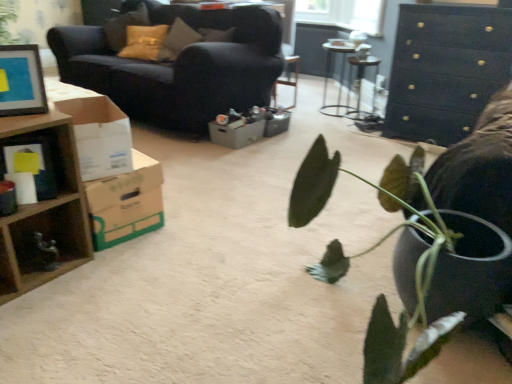
What is the approximate height of brown cardboard box at left, the 2th cardboard box from the back?

12.85 inches.

How much space does white cardboard box at left, positioned as the first cardboard box in front-to-back order, occupy horizontally?

white cardboard box at left, positioned as the first cardboard box in front-to-back order, is 26.90 centimeters in width.

The height and width of the screenshot is (384, 512). Describe the element at coordinates (361, 82) in the screenshot. I see `metallic silver table at center, the 2th table positioned from the left` at that location.

Identify the location of green matte plant at center. The height and width of the screenshot is (384, 512). click(x=370, y=251).

How much space does gray cardboard box at center, which ranks as the third cardboard box in front-to-back order, occupy horizontally?

It is 11.07 inches.

Describe the element at coordinates (330, 70) in the screenshot. The width and height of the screenshot is (512, 384). I see `metallic silver table at center, the second table from the right` at that location.

At what (x,y) coordinates should I click in order to perform the action: click on brown cardboard box at left, the 2th cardboard box from the back. Please return your answer as a coordinate pair (x, y). The height and width of the screenshot is (384, 512). Looking at the image, I should click on click(126, 203).

Which is in front, point (343, 74) or point (353, 65)?

The point (353, 65) is more forward.

Would you say metallic silver table at center, which ranks as the 1th table in right-to-left order, is part of metallic silver table at center, which is counted as the 1th table, starting from the left,'s contents?

Absolutely, metallic silver table at center, which ranks as the 1th table in right-to-left order, is inside metallic silver table at center, which is counted as the 1th table, starting from the left.

Where is `table below the metallic silver table at center, which is counted as the 1th table, starting from the left (from the image's perspective)`? This screenshot has height=384, width=512. table below the metallic silver table at center, which is counted as the 1th table, starting from the left (from the image's perspective) is located at coordinates (361, 82).

From a real-world perspective, does green matte plant at center sit lower than wooden cube at left?

No, from a real-world perspective, green matte plant at center is not beneath wooden cube at left.

Measure the distance from green matte plant at center to wooden cube at left.

green matte plant at center is 3.68 feet away from wooden cube at left.

Which of these two, green matte plant at center or wooden cube at left, is bigger?

green matte plant at center.

Is dark blue fabric couch at upper left behind metallic silver table at center, which is counted as the 1th table, starting from the left?

No.

From the image's perspective, is dark blue fabric couch at upper left positioned above or below metallic silver table at center, the second table from the right?

dark blue fabric couch at upper left is above metallic silver table at center, the second table from the right.

Who is bigger, dark blue fabric couch at upper left or metallic silver table at center, the second table from the right?

dark blue fabric couch at upper left is bigger.

Are dark blue fabric couch at upper left and metallic silver table at center, the second table from the right, located far from each other?

Yes, dark blue fabric couch at upper left is far from metallic silver table at center, the second table from the right.

From a real-world perspective, which object rests below the other?

gray cardboard box at center, which ranks as the third cardboard box in front-to-back order, from a real-world perspective.

Which object is positioned more to the right, gray cardboard box at center, which ranks as the third cardboard box in front-to-back order, or metallic silver table at center, which ranks as the 1th table in right-to-left order?

metallic silver table at center, which ranks as the 1th table in right-to-left order.

Which of these two, gray cardboard box at center, which ranks as the third cardboard box in front-to-back order, or metallic silver table at center, the 2th table positioned from the left, is bigger?

metallic silver table at center, the 2th table positioned from the left, is bigger.

How different are the orientations of gray cardboard box at center, the first cardboard box when ordered from back to front, and metallic silver table at center, which ranks as the 1th table in right-to-left order, in degrees?

The angular difference between gray cardboard box at center, the first cardboard box when ordered from back to front, and metallic silver table at center, which ranks as the 1th table in right-to-left order, is 90.8 degrees.

Does wooden cube at left come in front of brown cardboard box at left, the second cardboard box in the front-to-back sequence?

Yes, wooden cube at left is closer to the viewer.

Is brown cardboard box at left, the second cardboard box in the front-to-back sequence, at the back of wooden cube at left?

No, brown cardboard box at left, the second cardboard box in the front-to-back sequence, is not at the back of wooden cube at left.

Does wooden cube at left appear on the right side of brown cardboard box at left, the second cardboard box in the front-to-back sequence?

No.

Looking at this image, considering the sizes of objects wooden cube at left and brown cardboard box at left, the second cardboard box in the front-to-back sequence, in the image provided, who is taller, wooden cube at left or brown cardboard box at left, the second cardboard box in the front-to-back sequence,?

wooden cube at left is taller.

Which is behind, point (21, 224) or point (27, 55)?

The point (21, 224) is more distant.

Is wooden cube at left not close to matte black picture frame at upper left?

wooden cube at left is near matte black picture frame at upper left, not far away.

From the picture: Is wooden cube at left completely or partially outside of matte black picture frame at upper left?

Yes, wooden cube at left is not within matte black picture frame at upper left.

From a real-world perspective, does wooden cube at left sit lower than matte black picture frame at upper left?

Indeed, from a real-world perspective, wooden cube at left is positioned beneath matte black picture frame at upper left.

Looking at this image, is metallic silver table at center, the second table from the right, behind matte black picture frame at upper left?

Yes, metallic silver table at center, the second table from the right, is behind matte black picture frame at upper left.

Does metallic silver table at center, which is counted as the 1th table, starting from the left, appear on the left side of matte black picture frame at upper left?

In fact, metallic silver table at center, which is counted as the 1th table, starting from the left, is to the right of matte black picture frame at upper left.

Between metallic silver table at center, the second table from the right, and matte black picture frame at upper left, which one has smaller width?

With smaller width is matte black picture frame at upper left.

From the image's perspective, between metallic silver table at center, the second table from the right, and matte black picture frame at upper left, who is located below?

matte black picture frame at upper left, from the image's perspective.

Where is `table on the right of metallic silver table at center, the second table from the right`? table on the right of metallic silver table at center, the second table from the right is located at coordinates (361, 82).

Locate an element on the screen. desk above the green matte plant at center (from the image's perspective) is located at coordinates [x=52, y=199].

From the image, which object appears to be farther from brown cardboard box at left, the 2th cardboard box from the back, wooden box at left or dark blue fabric couch at upper left?

The object further to brown cardboard box at left, the 2th cardboard box from the back, is dark blue fabric couch at upper left.

From the image, which object appears to be nearer to wooden cube at left, gray cardboard box at center, which ranks as the third cardboard box in front-to-back order, or green matte plant at center?

The object closer to wooden cube at left is green matte plant at center.

Estimate the real-world distances between objects in this image. Which object is closer to brown cardboard box at left, the 2th cardboard box from the back, white cardboard box at left, the third cardboard box when ordered from back to front, or wooden box at left?

white cardboard box at left, the third cardboard box when ordered from back to front, is positioned closer to the anchor brown cardboard box at left, the 2th cardboard box from the back.

Considering their positions, is dark blue fabric couch at upper left positioned closer to brown cardboard box at left, the 2th cardboard box from the back, than gray cardboard box at center, the first cardboard box when ordered from back to front?

gray cardboard box at center, the first cardboard box when ordered from back to front, is closer to brown cardboard box at left, the 2th cardboard box from the back.

Consider the image. Considering their positions, is wooden cube at left positioned closer to black wood chest of drawers at upper right than matte black picture frame at upper left?

The object closer to black wood chest of drawers at upper right is wooden cube at left.

Considering their positions, is brown cardboard box at left, the 2th cardboard box from the back, positioned further to wooden cube at left than white cardboard box at left, the third cardboard box when ordered from back to front?

The object further to wooden cube at left is brown cardboard box at left, the 2th cardboard box from the back.

Looking at the image, which one is located further to metallic silver table at center, which ranks as the 1th table in right-to-left order, metallic silver table at center, which is counted as the 1th table, starting from the left, or green matte plant at center?

green matte plant at center.

Which object lies further to the anchor point green matte plant at center, metallic silver table at center, which ranks as the 1th table in right-to-left order, or gray cardboard box at center, which ranks as the third cardboard box in front-to-back order?

Among the two, metallic silver table at center, which ranks as the 1th table in right-to-left order, is located further to green matte plant at center.

This screenshot has height=384, width=512. In order to click on houseplant between dark blue fabric couch at upper left and black wood chest of drawers at upper right in the horizontal direction in this screenshot , I will do `click(370, 251)`.

Locate an element on the screen. The height and width of the screenshot is (384, 512). table between white cardboard box at left, the third cardboard box when ordered from back to front, and metallic silver table at center, the second table from the right, in the front-back direction is located at coordinates (361, 82).

Identify the location of box between dark blue fabric couch at upper left and brown cardboard box at left, the 2th cardboard box from the back, from top to bottom. This screenshot has height=384, width=512. (38, 165).

At what (x,y) coordinates should I click in order to perform the action: click on studio couch between wooden box at left and black wood chest of drawers at upper right in the horizontal direction. Please return your answer as a coordinate pair (x, y). The width and height of the screenshot is (512, 384). Looking at the image, I should click on (179, 67).